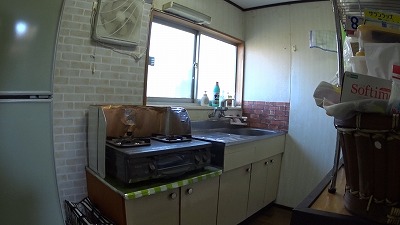
Where is `exposed whitewash brick`? exposed whitewash brick is located at coordinates (x=74, y=65).